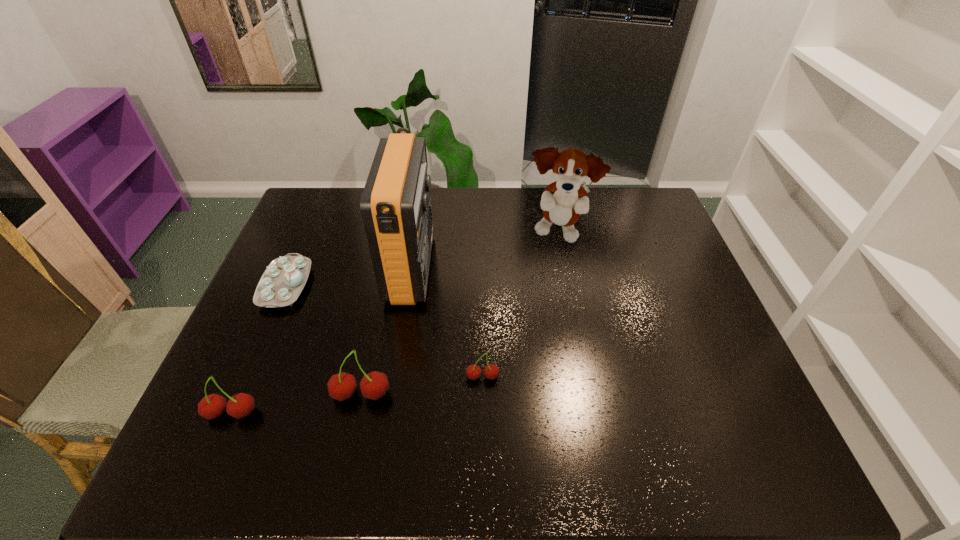
Observe the arrangement of all cherrys in the image. To keep them evenly spaced, where would you place another cherry on the right? Please locate a free space. Please provide its 2D coordinates. Your answer should be formatted as a tuple, i.e. [(x, y)], where the tuple contains the x and y coordinates of a point satisfying the conditions above.

[(597, 360)]